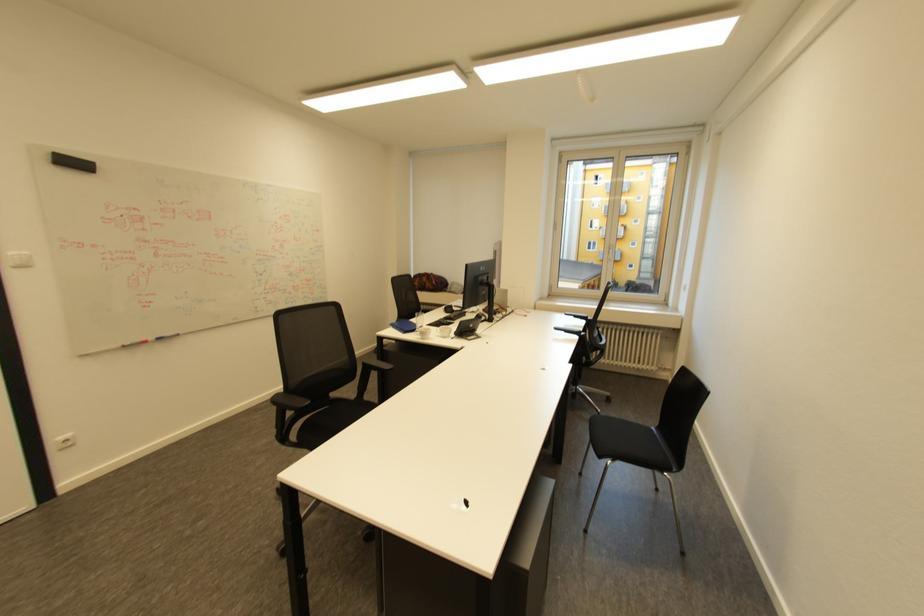
Which object does [167,336] point to?

It refers to a blue whiteboard marker.